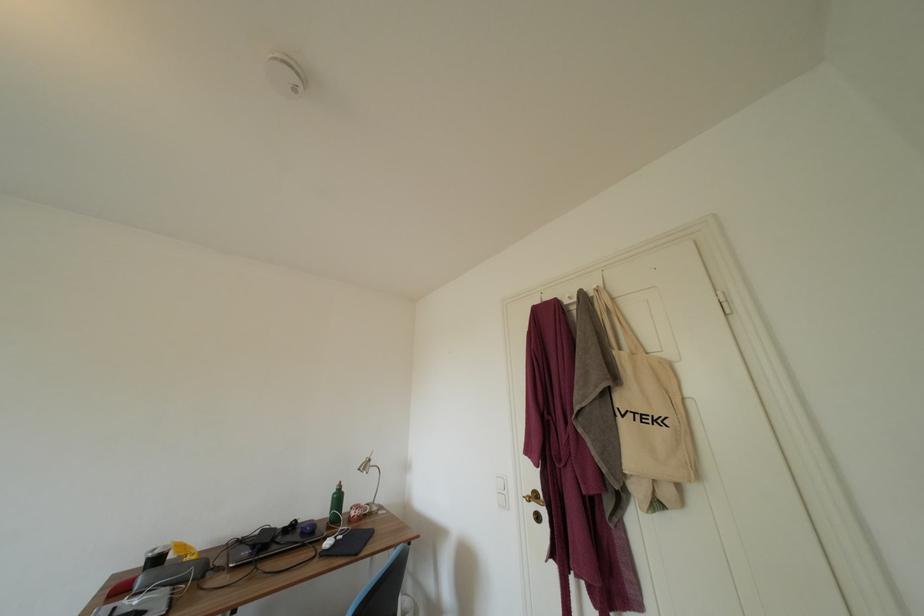
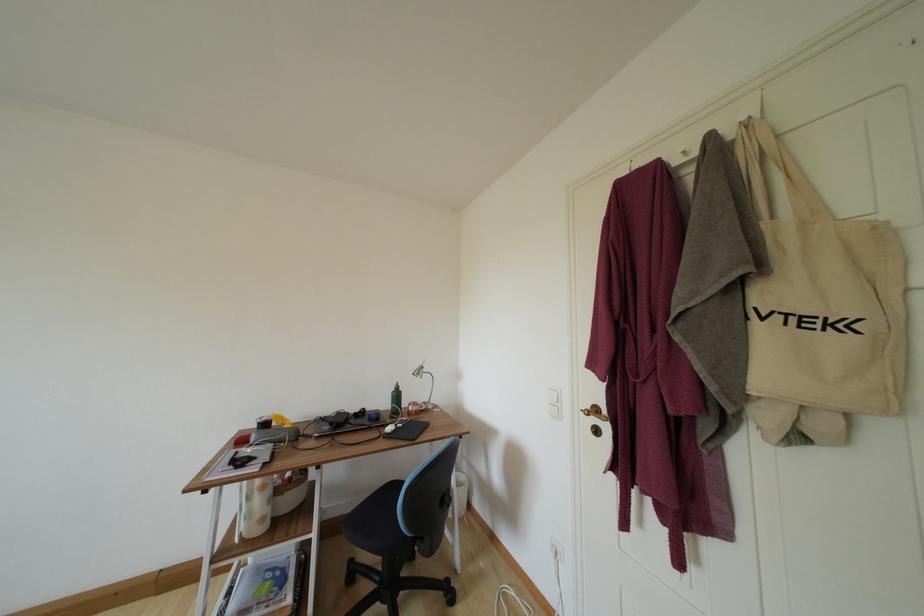
Where in the second image is the point corresponding to (x=377, y=467) from the first image?

(430, 374)